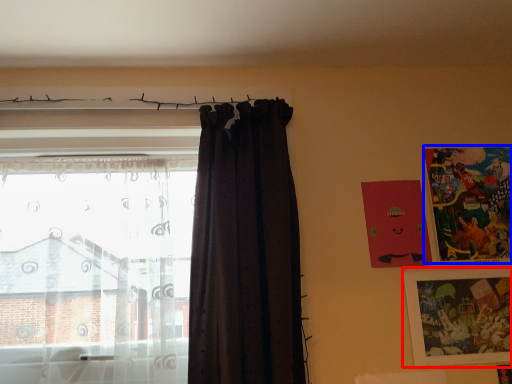
Question: Which point is closer to the camera, picture frame (highlighted by a red box) or picture frame (highlighted by a blue box)?

Choices:
 (A) picture frame
 (B) picture frame

Answer: (A)